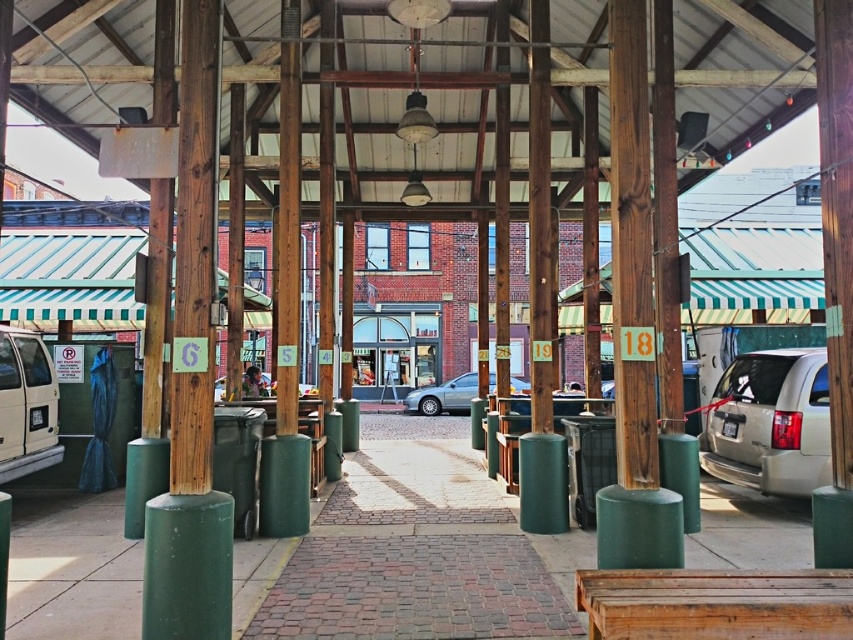
From the picture: You are standing at the entrance of the market and want to park your silver metallic minivan at right. The parking spot is at coordinates 0.661, 0.904. Is your vehicle already in the correct parking spot?

The silver metallic minivan at right is already positioned at the coordinates [770,422], so it is in the correct parking spot.

You are standing at the entrance of the market and want to locate two specific points marked in the image. Which point, point (386, 618) or point (0, 433), is closer to you?

Point (386, 618) is closer to the viewer than point (0, 433).